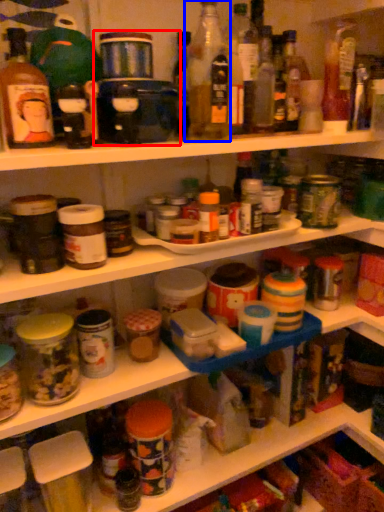
Question: Among these objects, which one is farthest to the camera, appliance (highlighted by a red box) or bottle (highlighted by a blue box)?

Choices:
 (A) appliance
 (B) bottle

Answer: (A)